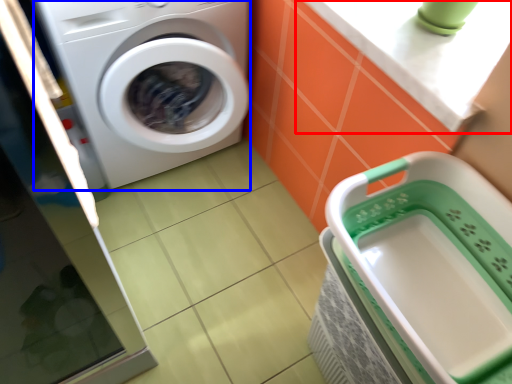
Question: Among these objects, which one is farthest to the camera, counter top (highlighted by a red box) or washing machine (highlighted by a blue box)?

Choices:
 (A) counter top
 (B) washing machine

Answer: (B)